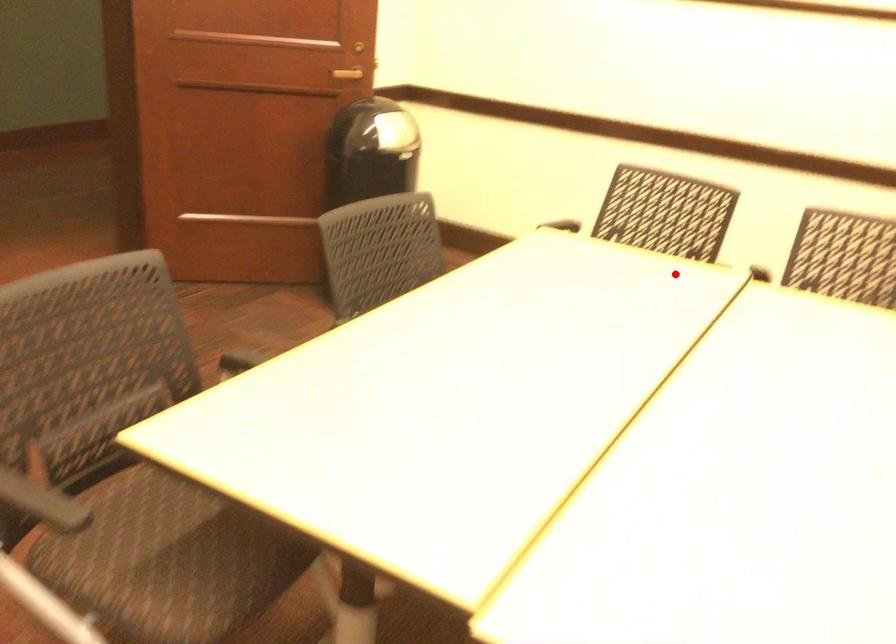
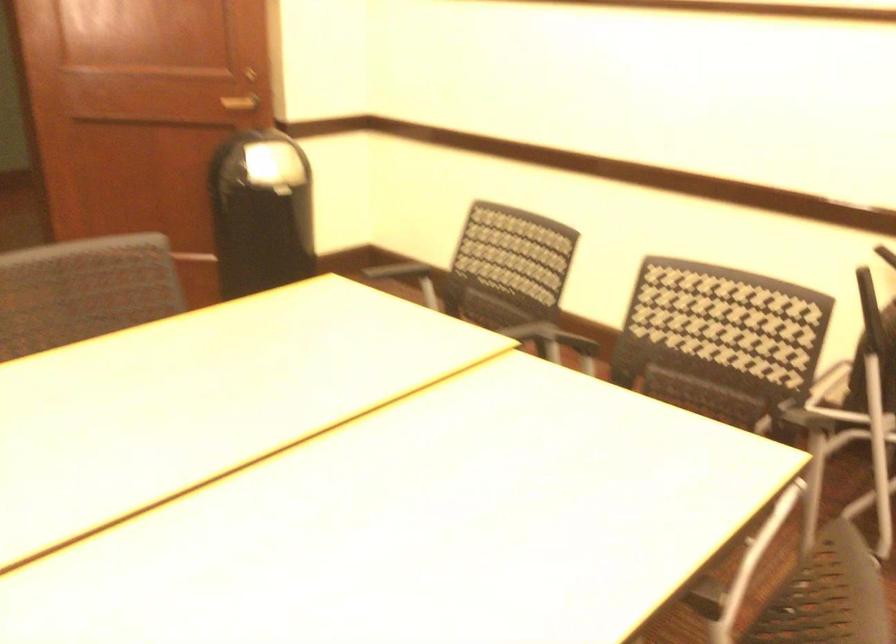
Question: A red point is marked in image1. In image2, is the corresponding 3D point closer to the camera or farther? Reply with the corresponding letter.

Choices:
 (A) The corresponding 3D point is closer.
 (B) The corresponding 3D point is farther.

Answer: (A)